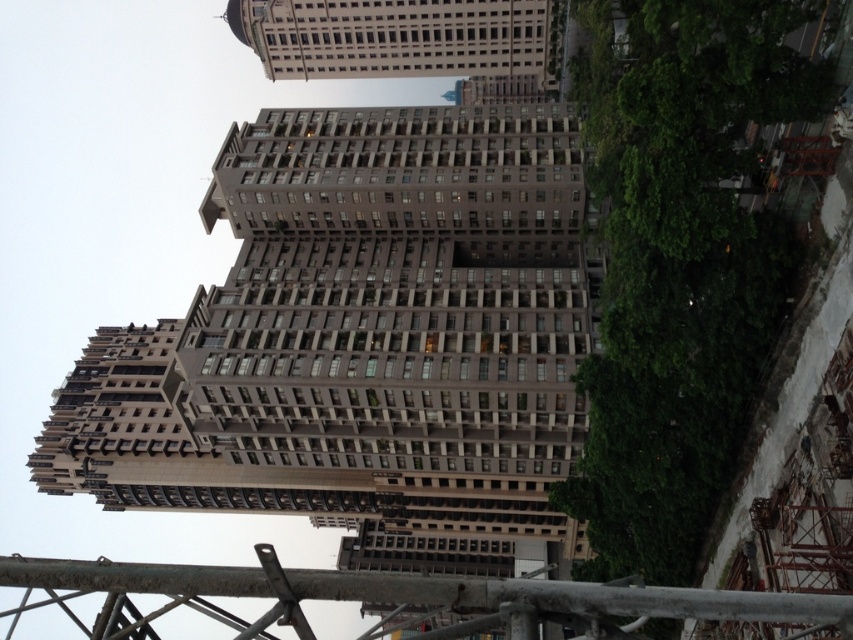
Question: Among these objects, which one is farthest from the camera?

Choices:
 (A) metallic scaffolding at center
 (B) beige stone building at upper center

Answer: (B)

Question: Does metallic scaffolding at center have a greater width compared to beige stone building at upper center?

Choices:
 (A) yes
 (B) no

Answer: (A)

Question: Is metallic scaffolding at center to the right of beige stone building at upper center from the viewer's perspective?

Choices:
 (A) no
 (B) yes

Answer: (A)

Question: Which point is farther to the camera?

Choices:
 (A) (364, 33)
 (B) (836, 612)

Answer: (A)

Question: Which of the following is the farthest from the observer?

Choices:
 (A) (318, 10)
 (B) (222, 616)

Answer: (A)

Question: Is metallic scaffolding at center to the right of beige stone building at upper center from the viewer's perspective?

Choices:
 (A) no
 (B) yes

Answer: (A)